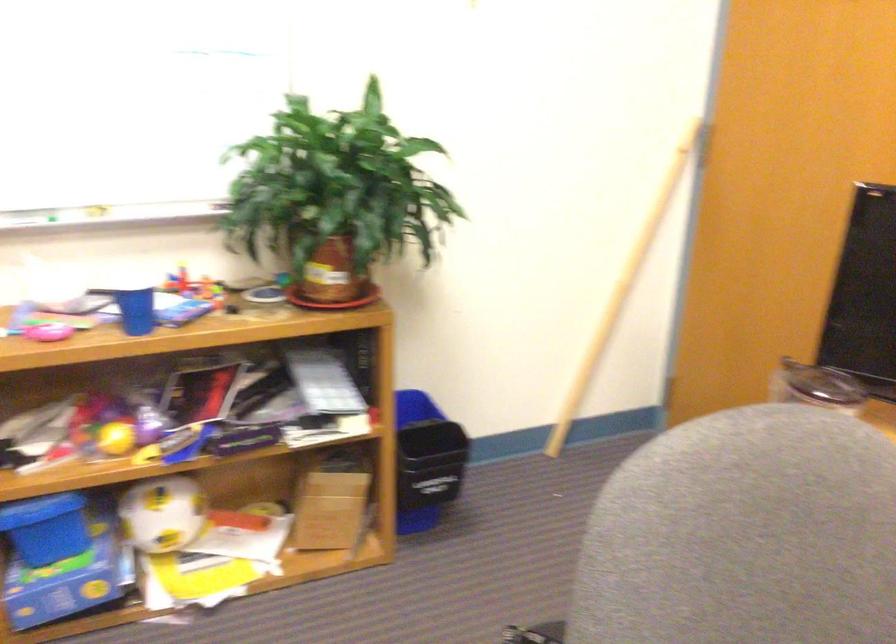
The width and height of the screenshot is (896, 644). I want to click on white soccer ball, so click(x=162, y=513).